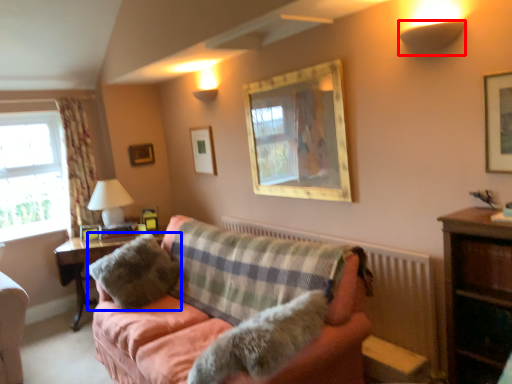
Question: Which object is further to the camera taking this photo, lamp (highlighted by a red box) or pillow (highlighted by a blue box)?

Choices:
 (A) lamp
 (B) pillow

Answer: (B)